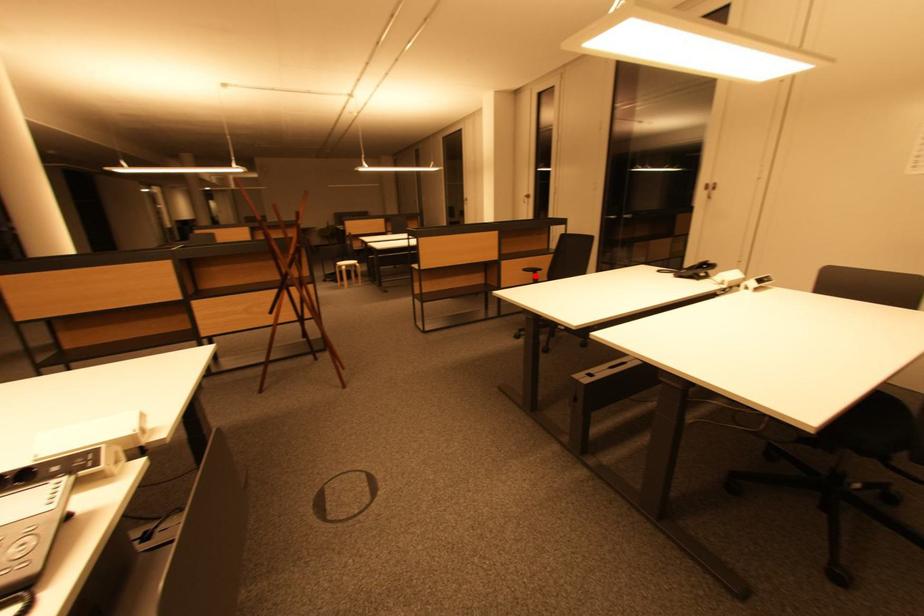
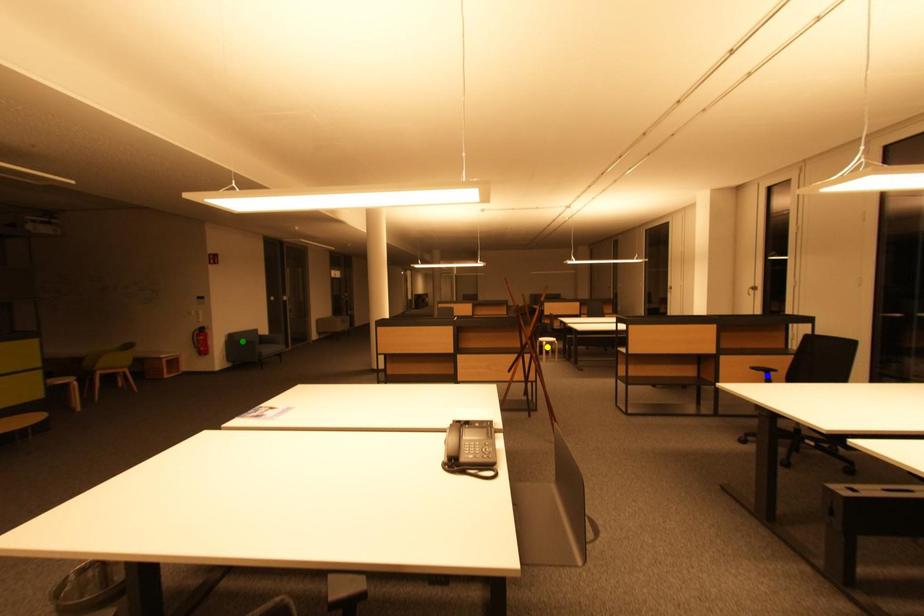
Question: I am providing you with two images of the same scene from different viewpoints. A red point is marked on the first image. You are given multiple points on the second image. Which spot in image 2 lines up with the point in image 1?

Choices:
 (A) green point
 (B) yellow point
 (C) blue point

Answer: (C)